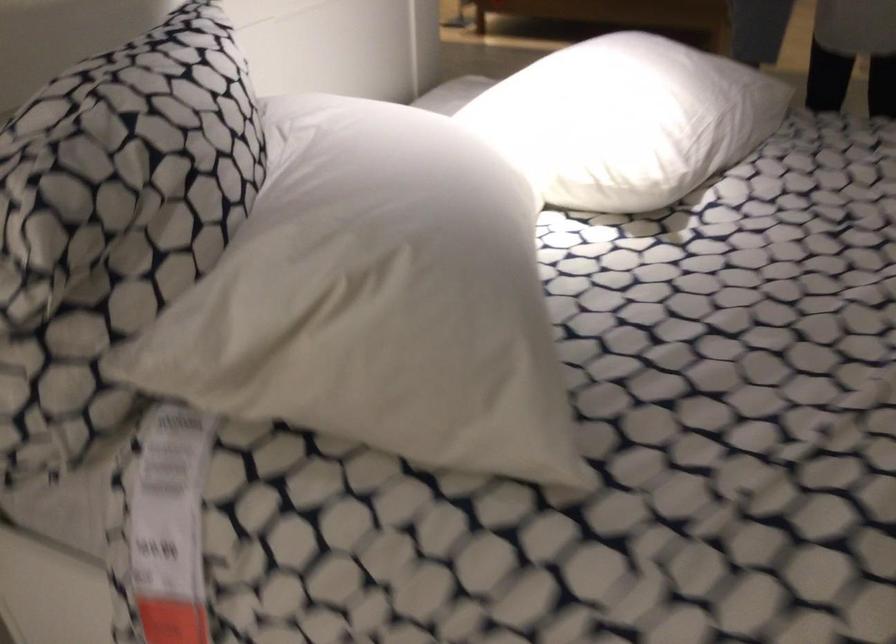
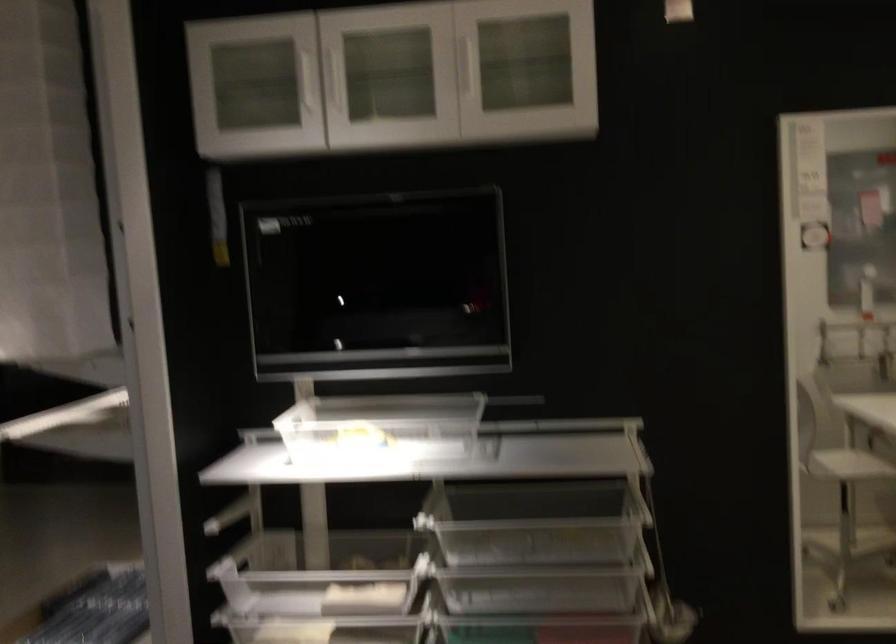
Question: How did the camera likely rotate?

Choices:
 (A) Left
 (B) Right
 (C) Up
 (D) Down

Answer: (B)